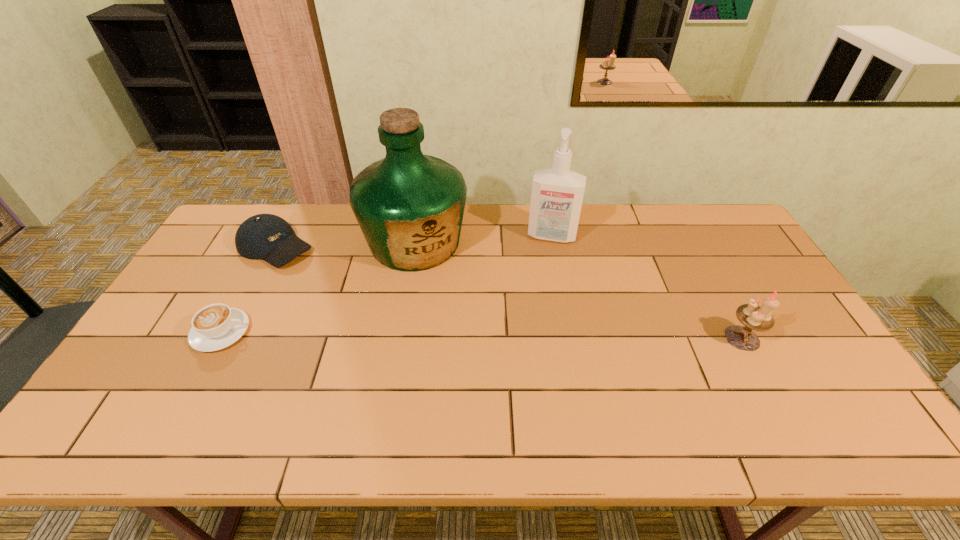
This screenshot has height=540, width=960. I want to click on free space on the desktop that is between the shortest object and the candle holder and is positioned on the label side of the third object from left to right, so click(x=455, y=335).

The width and height of the screenshot is (960, 540). In order to click on vacant space on the desktop that is between the shortest object and the rightmost object and is positioned on the front label of the second tallest object in this screenshot , I will do `click(534, 336)`.

This screenshot has width=960, height=540. Identify the location of free spot on the desktop that is between the shortest object and the third shortest object and is positioned on the front-facing side of the fourth tallest object. (416, 334).